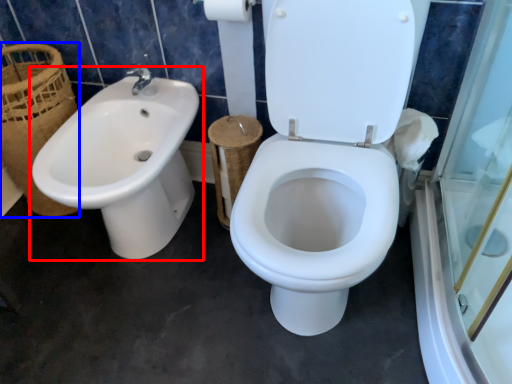
Question: Which of the following is the closest to the observer, sink (highlighted by a red box) or basket (highlighted by a blue box)?

Choices:
 (A) sink
 (B) basket

Answer: (A)